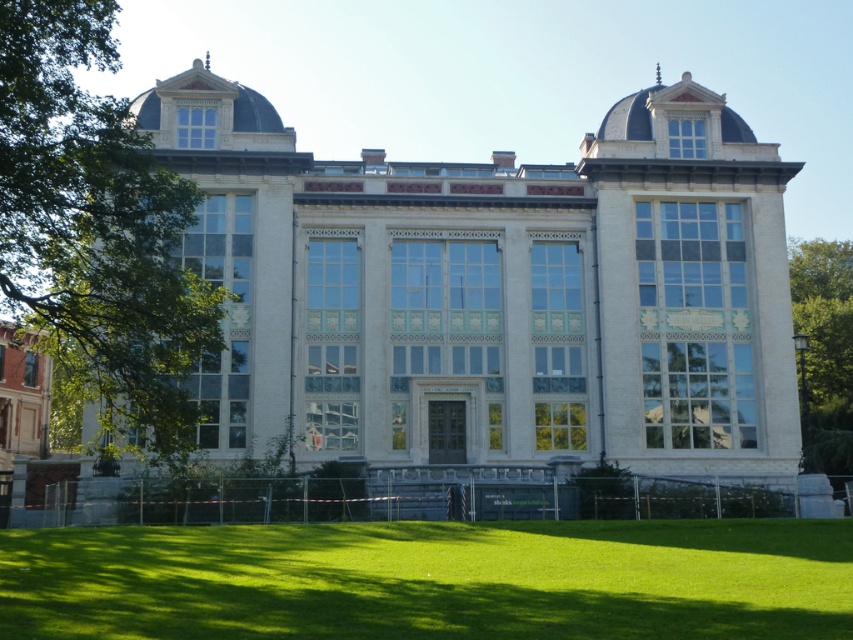
Question: Which object appears farthest from the camera in this image?

Choices:
 (A) green leafy tree at left
 (B) green leafy tree at right

Answer: (B)

Question: Where is green grass at lower center located in relation to green leafy tree at left in the image?

Choices:
 (A) above
 (B) below

Answer: (B)

Question: Which object is positioned closest to the green leafy tree at right?

Choices:
 (A) green grass at lower center
 (B) green leafy tree at left

Answer: (A)

Question: Is green leafy tree at left thinner than green leafy tree at right?

Choices:
 (A) no
 (B) yes

Answer: (B)

Question: Does green grass at lower center appear over green leafy tree at left?

Choices:
 (A) no
 (B) yes

Answer: (A)

Question: Which is farther from the green leafy tree at right?

Choices:
 (A) green grass at lower center
 (B) green leafy tree at left

Answer: (B)